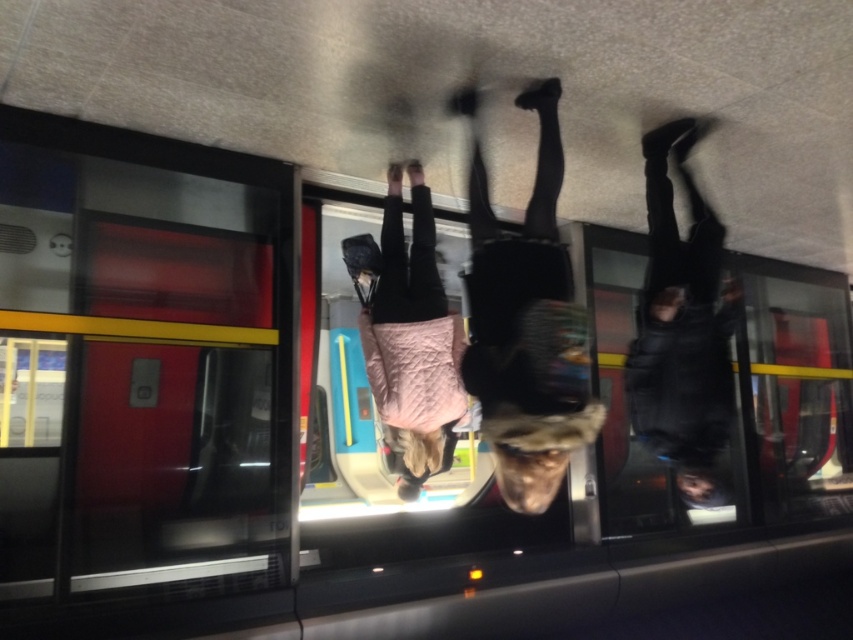
Looking at this image, you are standing inside a train station and looking through the window. You see a person reflected in the window wearing a pink quilted jacket and carrying a black bag. Where exactly on the person is the point located at coordinates (x=526, y=323)?

The point at (x=526, y=323) is located on the black leather pants at center.